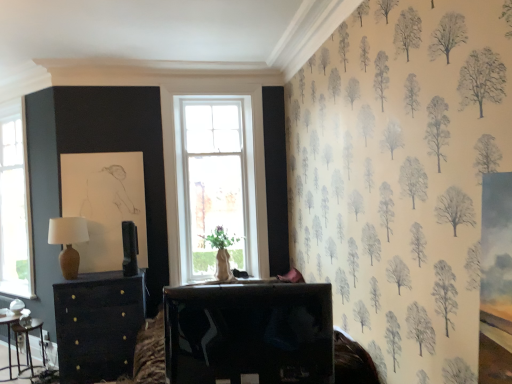
What is the approximate height of metallic silver table at lower left, the second table positioned from the back?

metallic silver table at lower left, the second table positioned from the back, is 22.57 inches tall.

What do you see at coordinates (98, 325) in the screenshot? I see `matte black chest of drawers at left` at bounding box center [98, 325].

Identify the location of metallic silver table at lower left, marked as the third table in a right-to-left arrangement. (9, 339).

How much distance is there between metallic silver table at lower left, the second table positioned from the back, and wooden table at lower left, which is the 3th table in front-to-back order?

They are 12.44 centimeters apart.

Considering the relative sizes of metallic silver table at lower left, marked as the third table in a right-to-left arrangement, and wooden table at lower left, which is counted as the second table, starting from the left, in the image provided, is metallic silver table at lower left, marked as the third table in a right-to-left arrangement, bigger than wooden table at lower left, which is counted as the second table, starting from the left,?

Yes.

Which object is closer to the camera, metallic silver table at lower left, the second table from the front, or wooden table at lower left, which is counted as the second table, starting from the left?

metallic silver table at lower left, the second table from the front, is closer to the camera.

From a real-world perspective, who is located lower, metallic silver table at lower left, the second table from the front, or wooden table at lower left, positioned as the second table in right-to-left order?

wooden table at lower left, positioned as the second table in right-to-left order.

Is matte black chest of drawers at left surrounding metallic silver table at lower left, the second table positioned from the back?

No, metallic silver table at lower left, the second table positioned from the back, is not a part of matte black chest of drawers at left.

Based on the photo, does matte black chest of drawers at left come behind metallic silver table at lower left, marked as the third table in a right-to-left arrangement?

No.

Who is smaller, matte black chest of drawers at left or metallic silver table at lower left, the second table from the front?

With smaller size is metallic silver table at lower left, the second table from the front.

Which is more to the right, matte black chest of drawers at left or metallic silver table at lower left, the second table from the front?

matte black chest of drawers at left is more to the right.

Considering the relative positions of matte black chest of drawers at left and shiny black tv at center, placed as the first table when sorted from front to back, in the image provided, is matte black chest of drawers at left to the left or to the right of shiny black tv at center, placed as the first table when sorted from front to back,?

matte black chest of drawers at left is positioned on shiny black tv at center, placed as the first table when sorted from front to back,'s left side.

Is matte black chest of drawers at left not close to shiny black tv at center, placed as the first table when sorted from front to back?

Yes, matte black chest of drawers at left and shiny black tv at center, placed as the first table when sorted from front to back, are located far from each other.

At what (x,y) coordinates should I click in order to perform the action: click on chest of drawers to the left of shiny black tv at center, placed as the 3th table when sorted from back to front. Please return your answer as a coordinate pair (x, y). The width and height of the screenshot is (512, 384). Looking at the image, I should click on (98, 325).

From the image's perspective, which one is positioned higher, matte black chest of drawers at left or shiny black tv at center, which is the third table from left to right?

shiny black tv at center, which is the third table from left to right, appears higher in the image.

Considering the sizes of objects shiny black tv at center, placed as the 3th table when sorted from back to front, and matte black chest of drawers at left in the image provided, who is thinner, shiny black tv at center, placed as the 3th table when sorted from back to front, or matte black chest of drawers at left?

Thinner between the two is shiny black tv at center, placed as the 3th table when sorted from back to front.

Locate an element on the screen. The image size is (512, 384). table in front of the matte black chest of drawers at left is located at coordinates (249, 334).

Measure the distance from shiny black tv at center, arranged as the first table when viewed from the right, to matte black chest of drawers at left.

1.71 meters.

Considering the sizes of objects shiny black tv at center, placed as the 3th table when sorted from back to front, and matte black chest of drawers at left in the image provided, who is shorter, shiny black tv at center, placed as the 3th table when sorted from back to front, or matte black chest of drawers at left?

shiny black tv at center, placed as the 3th table when sorted from back to front.

Is point (18, 351) positioned in front of point (67, 337)?

No, it is not.

Would you say matte black chest of drawers at left is part of wooden table at lower left, which is the 3th table in front-to-back order,'s contents?

No, matte black chest of drawers at left is not a part of wooden table at lower left, which is the 3th table in front-to-back order.

From the image's perspective, relative to matte black chest of drawers at left, is wooden table at lower left, which is the 3th table in front-to-back order, above or below?

Based on their image positions, wooden table at lower left, which is the 3th table in front-to-back order, is located beneath matte black chest of drawers at left.

Is wooden table at lower left, which is counted as the 1th table, starting from the back, oriented towards matte black chest of drawers at left?

No, wooden table at lower left, which is counted as the 1th table, starting from the back, is not facing towards matte black chest of drawers at left.

Considering the positions of points (0, 316) and (121, 281), is point (0, 316) closer to camera compared to point (121, 281)?

No, (0, 316) is behind (121, 281).

Does metallic silver table at lower left, marked as the third table in a right-to-left arrangement, touch matte black chest of drawers at left?

No.

Which object is wider, metallic silver table at lower left, the second table positioned from the back, or matte black chest of drawers at left?

matte black chest of drawers at left is wider.

Locate an element on the screen. This screenshot has width=512, height=384. chest of drawers in front of the metallic silver table at lower left, positioned as the 1th table in left-to-right order is located at coordinates click(x=98, y=325).

From a real-world perspective, who is located lower, matte brown table lamp at left or metallic silver table at lower left, positioned as the 1th table in left-to-right order?

metallic silver table at lower left, positioned as the 1th table in left-to-right order, from a real-world perspective.

In the scene shown: Is matte brown table lamp at left in front of or behind metallic silver table at lower left, the second table from the front, in the image?

matte brown table lamp at left is in front of metallic silver table at lower left, the second table from the front.

Which is more to the right, matte brown table lamp at left or metallic silver table at lower left, positioned as the 1th table in left-to-right order?

matte brown table lamp at left.

Between matte brown table lamp at left and metallic silver table at lower left, the second table from the front, which one has larger width?

metallic silver table at lower left, the second table from the front, is wider.

From the image's perspective, which table is the 1st one above the wooden table at lower left, positioned as the second table in right-to-left order? Please provide its 2D coordinates.

[(9, 339)]

Image resolution: width=512 pixels, height=384 pixels. Find the location of `the chest of drawers that appears above the metallic silver table at lower left, marked as the third table in a right-to-left arrangement (from a real-world perspective)`. the chest of drawers that appears above the metallic silver table at lower left, marked as the third table in a right-to-left arrangement (from a real-world perspective) is located at coordinates (98, 325).

Looking at the image, which one is located further to matte brown table lamp at left, wooden table at lower left, which is counted as the 1th table, starting from the back, or metallic silver table at lower left, the second table from the front?

The object further to matte brown table lamp at left is metallic silver table at lower left, the second table from the front.

Based on their spatial positions, is matte brown table lamp at left or wooden table at lower left, which is counted as the second table, starting from the left, closer to metallic silver table at lower left, the second table positioned from the back?

wooden table at lower left, which is counted as the second table, starting from the left, is positioned closer to the anchor metallic silver table at lower left, the second table positioned from the back.

Which object lies further to the anchor point matte black chest of drawers at left, matte brown table lamp at left or wooden table at lower left, which is counted as the second table, starting from the left?

Based on the image, wooden table at lower left, which is counted as the second table, starting from the left, appears to be further to matte black chest of drawers at left.

Estimate the real-world distances between objects in this image. Which object is further from wooden table at lower left, which is the 3th table in front-to-back order, metallic silver table at lower left, marked as the third table in a right-to-left arrangement, or shiny black tv at center, placed as the 3th table when sorted from back to front?

Based on the image, shiny black tv at center, placed as the 3th table when sorted from back to front, appears to be further to wooden table at lower left, which is the 3th table in front-to-back order.

Considering their positions, is metallic silver table at lower left, the second table positioned from the back, positioned closer to matte brown table lamp at left than shiny black tv at center, which is the third table from left to right?

metallic silver table at lower left, the second table positioned from the back, lies closer to matte brown table lamp at left than the other object.

From the image, which object appears to be nearer to metallic silver table at lower left, marked as the third table in a right-to-left arrangement, matte black chest of drawers at left or shiny black tv at center, placed as the 3th table when sorted from back to front?

Among the two, matte black chest of drawers at left is located nearer to metallic silver table at lower left, marked as the third table in a right-to-left arrangement.

Estimate the real-world distances between objects in this image. Which object is closer to matte brown table lamp at left, metallic silver table at lower left, positioned as the 1th table in left-to-right order, or wooden table at lower left, which is counted as the 1th table, starting from the back?

The object closer to matte brown table lamp at left is wooden table at lower left, which is counted as the 1th table, starting from the back.

Estimate the real-world distances between objects in this image. Which object is closer to wooden table at lower left, which is counted as the 1th table, starting from the back, matte brown table lamp at left or metallic silver table at lower left, the second table positioned from the back?

metallic silver table at lower left, the second table positioned from the back.

The image size is (512, 384). I want to click on table lamp between wooden table at lower left, positioned as the second table in right-to-left order, and shiny black tv at center, placed as the first table when sorted from front to back, in the horizontal direction, so click(68, 242).

Identify the location of chest of drawers between shiny black tv at center, placed as the first table when sorted from front to back, and matte brown table lamp at left, along the z-axis. (98, 325).

Where is `table between metallic silver table at lower left, the second table from the front, and matte black chest of drawers at left, in the horizontal direction`? The height and width of the screenshot is (384, 512). table between metallic silver table at lower left, the second table from the front, and matte black chest of drawers at left, in the horizontal direction is located at coordinates coord(29,346).

Locate an element on the screen. The width and height of the screenshot is (512, 384). chest of drawers between wooden table at lower left, which is the 3th table in front-to-back order, and shiny black tv at center, placed as the 3th table when sorted from back to front, in the horizontal direction is located at coordinates (98, 325).